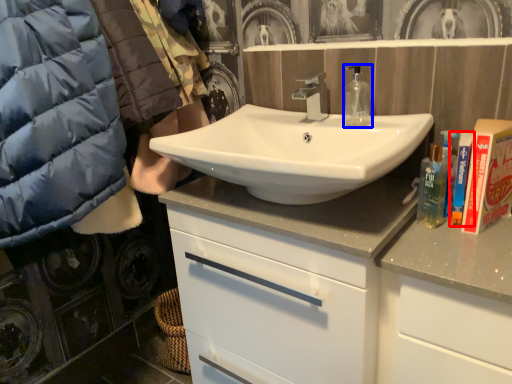
Question: Among these objects, which one is farthest to the camera, toiletry (highlighted by a red box) or mouthwash (highlighted by a blue box)?

Choices:
 (A) toiletry
 (B) mouthwash

Answer: (B)